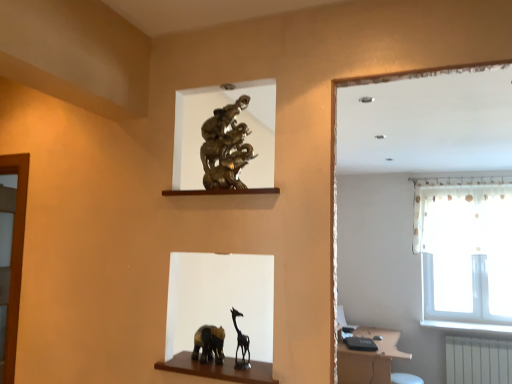
Question: Is white sheer curtain at upper right facing towards white plastic radiator at lower right?

Choices:
 (A) yes
 (B) no

Answer: (B)

Question: From the image's perspective, is white sheer curtain at upper right on white plastic radiator at lower right?

Choices:
 (A) no
 (B) yes

Answer: (B)

Question: Can we say white sheer curtain at upper right lies outside white plastic radiator at lower right?

Choices:
 (A) yes
 (B) no

Answer: (A)

Question: Is white sheer curtain at upper right far away from white plastic radiator at lower right?

Choices:
 (A) yes
 (B) no

Answer: (A)

Question: Does white sheer curtain at upper right contain white plastic radiator at lower right?

Choices:
 (A) no
 (B) yes

Answer: (A)

Question: Is white plastic radiator at lower right to the left or to the right of matte brown vanity at lower right in the image?

Choices:
 (A) left
 (B) right

Answer: (B)

Question: From the image's perspective, is white plastic radiator at lower right above or below matte brown vanity at lower right?

Choices:
 (A) above
 (B) below

Answer: (B)

Question: Is white plastic radiator at lower right inside or outside of matte brown vanity at lower right?

Choices:
 (A) inside
 (B) outside

Answer: (B)

Question: Looking at the image, does white plastic radiator at lower right seem bigger or smaller compared to matte brown vanity at lower right?

Choices:
 (A) big
 (B) small

Answer: (B)

Question: Considering the positions of point click(x=415, y=188) and point click(x=449, y=372), is point click(x=415, y=188) closer or farther from the camera than point click(x=449, y=372)?

Choices:
 (A) closer
 (B) farther

Answer: (B)

Question: From a real-world perspective, is white sheer curtain at upper right positioned above or below white plastic radiator at lower right?

Choices:
 (A) below
 (B) above

Answer: (B)

Question: Based on their positions, is white sheer curtain at upper right located to the left or right of white plastic radiator at lower right?

Choices:
 (A) right
 (B) left

Answer: (B)

Question: Looking at their shapes, would you say white sheer curtain at upper right is wider or thinner than white plastic radiator at lower right?

Choices:
 (A) wide
 (B) thin

Answer: (A)

Question: From a real-world perspective, is matte brown vanity at lower right physically located above or below white sheer curtain at upper right?

Choices:
 (A) above
 (B) below

Answer: (B)

Question: Considering the positions of matte brown vanity at lower right and white sheer curtain at upper right in the image, is matte brown vanity at lower right taller or shorter than white sheer curtain at upper right?

Choices:
 (A) tall
 (B) short

Answer: (B)